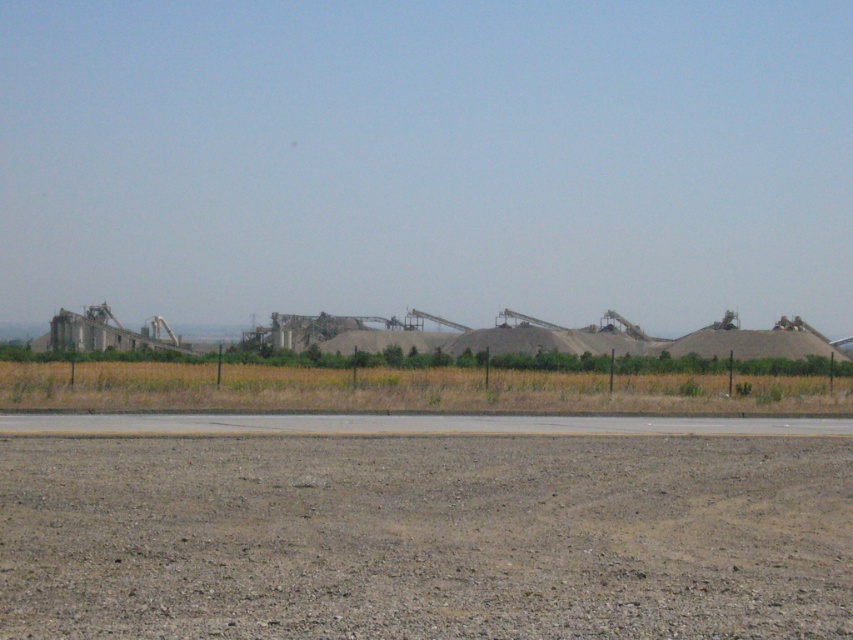
You are standing at the point labeled as point (425, 536) in the image. Looking around, you see the brown gravelly dirt at lower center. Which direction should you walk to reach the paved road running horizontally across the middle of the image?

The brown gravelly dirt at lower center is located at point (425, 536). Since the paved road is in the middle of the image, you should walk northward to reach it from the lower center position.

You are a delivery truck driver who needs to transport heavy equipment across the site. You see the brown gravelly dirt at lower center and the gray asphalt runway at center. Which path would provide a more stable surface for your heavy load?

The gray asphalt runway at center provides a more stable surface for heavy equipment because asphalt is generally more durable and stable than gravelly dirt. Additionally, the gray asphalt runway at center is wider than the brown gravelly dirt at lower center according to the description, which may contribute to better load distribution and stability.